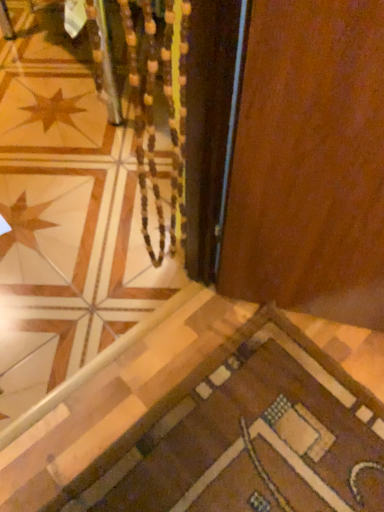
At what (x,y) coordinates should I click in order to perform the action: click on wooden stairs at lower right. Please return your answer as a coordinate pair (x, y). The image size is (384, 512). Looking at the image, I should click on (210, 426).

Describe the element at coordinates (210, 426) in the screenshot. The height and width of the screenshot is (512, 384). I see `wooden stairs at lower right` at that location.

Locate an element on the screen. The image size is (384, 512). wooden stairs at lower right is located at coordinates tap(210, 426).